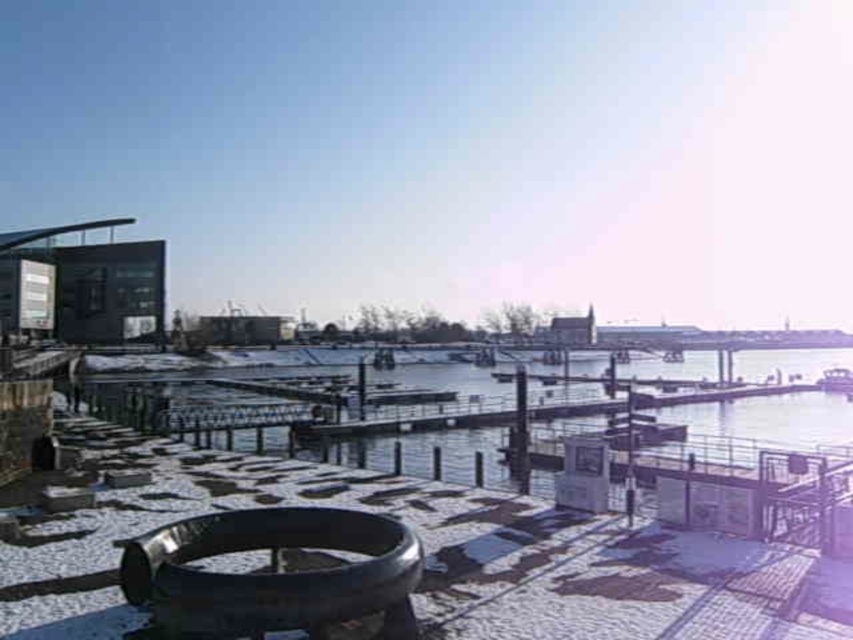
Which of these two, shiny black tire at lower center or metallic silver boat at lower right, stands shorter?

shiny black tire at lower center is shorter.

Does shiny black tire at lower center have a lesser width compared to metallic silver boat at lower right?

Yes.

Locate an element on the screen. The width and height of the screenshot is (853, 640). shiny black tire at lower center is located at coordinates (273, 573).